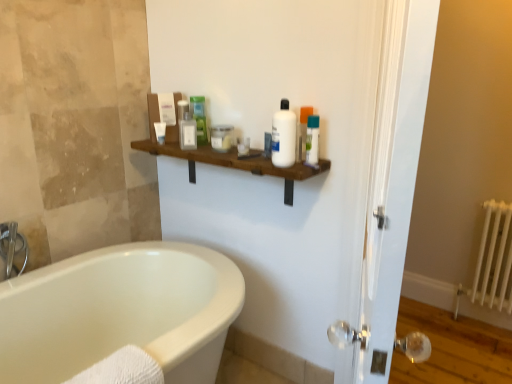
Question: Is brushed metal faucet at left next to green matte tube at upper center, which is the 4th toiletry in left-to-right order, and touching it?

Choices:
 (A) yes
 (B) no

Answer: (B)

Question: From a real-world perspective, is brushed metal faucet at left physically above green matte tube at upper center, which is the 4th toiletry in left-to-right order?

Choices:
 (A) yes
 (B) no

Answer: (B)

Question: From the image's perspective, is brushed metal faucet at left below green matte tube at upper center, which is the 4th toiletry in left-to-right order?

Choices:
 (A) no
 (B) yes

Answer: (B)

Question: Is brushed metal faucet at left in front of green matte tube at upper center, which is the 4th toiletry in left-to-right order?

Choices:
 (A) yes
 (B) no

Answer: (A)

Question: Is the depth of brushed metal faucet at left greater than that of green matte tube at upper center, the fifth toiletry viewed from the right?

Choices:
 (A) no
 (B) yes

Answer: (A)

Question: Could you tell me if brushed metal faucet at left is facing green matte tube at upper center, the fifth toiletry viewed from the right?

Choices:
 (A) no
 (B) yes

Answer: (A)

Question: Is green matte tube at upper center, which is the 4th toiletry in left-to-right order, at the left side of white glossy lotion at upper center, the 8th toiletry when ordered from left to right?

Choices:
 (A) no
 (B) yes

Answer: (B)

Question: Could you tell me if green matte tube at upper center, the fifth toiletry viewed from the right, is turned towards white glossy lotion at upper center, which is counted as the first toiletry, starting from the right?

Choices:
 (A) no
 (B) yes

Answer: (A)

Question: From a real-world perspective, is green matte tube at upper center, the fifth toiletry viewed from the right, on top of white glossy lotion at upper center, the 8th toiletry when ordered from left to right?

Choices:
 (A) yes
 (B) no

Answer: (A)

Question: Is green matte tube at upper center, which is the 4th toiletry in left-to-right order, not within white glossy lotion at upper center, the 8th toiletry when ordered from left to right?

Choices:
 (A) no
 (B) yes

Answer: (B)

Question: Does green matte tube at upper center, the fifth toiletry viewed from the right, have a lesser height compared to white glossy lotion at upper center, which is counted as the first toiletry, starting from the right?

Choices:
 (A) no
 (B) yes

Answer: (A)

Question: From a real-world perspective, is green matte tube at upper center, the fifth toiletry viewed from the right, located beneath white glossy lotion at upper center, which is counted as the first toiletry, starting from the right?

Choices:
 (A) yes
 (B) no

Answer: (B)

Question: Would you say brushed metal faucet at left contains white metal radiator at right?

Choices:
 (A) yes
 (B) no

Answer: (B)